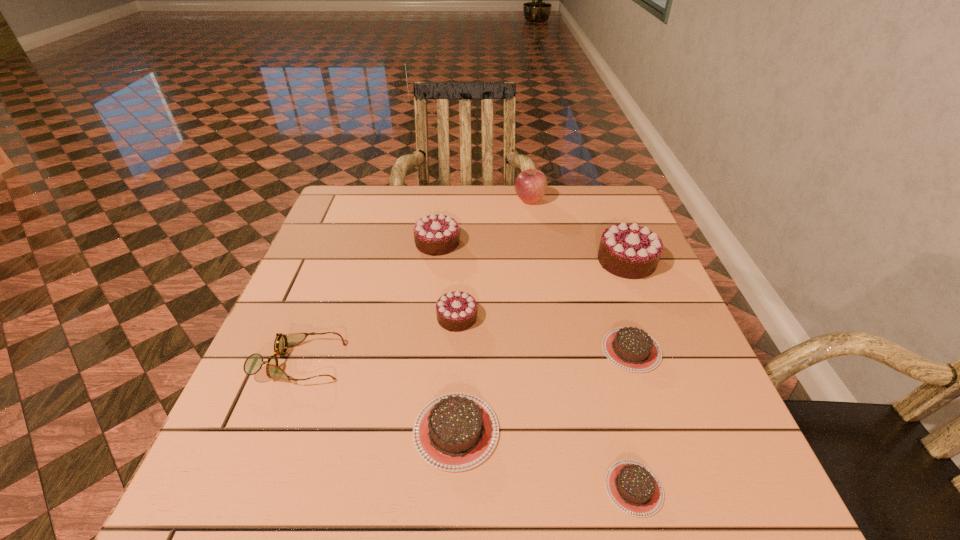
Where is `the third shortest chocolate cake`? Image resolution: width=960 pixels, height=540 pixels. the third shortest chocolate cake is located at coordinates (454, 432).

Where is `the leftmost brown chocolate cake`? The height and width of the screenshot is (540, 960). the leftmost brown chocolate cake is located at coordinates (454, 432).

This screenshot has height=540, width=960. What are the coordinates of `the farthest brown chocolate cake` in the screenshot? It's located at tap(632, 349).

Find the location of `the second shortest chocolate cake`. the second shortest chocolate cake is located at coordinates (632, 349).

You are a GUI agent. You are given a task and a screenshot of the screen. Output one action in this format:
    pyautogui.click(x=<x>, y=<y>)
    Task: Click on the smallest brown chocolate cake
    Image resolution: width=960 pixels, height=540 pixels.
    Given the screenshot: What is the action you would take?
    pyautogui.click(x=634, y=488)

Where is `the shortest object`? the shortest object is located at coordinates (634, 488).

Find the location of a particular element. The height and width of the screenshot is (540, 960). vacant space located 0.150m on the left of the apple is located at coordinates (465, 200).

This screenshot has height=540, width=960. Identify the location of free region located 0.200m on the left of the biggest chocolate chocolate cake. (519, 261).

Where is `free space located 0.090m on the left of the second biggest chocolate chocolate cake`? This screenshot has width=960, height=540. free space located 0.090m on the left of the second biggest chocolate chocolate cake is located at coordinates (381, 243).

Locate an element on the screen. blank space located on the front of the nearest chocolate chocolate cake is located at coordinates (447, 496).